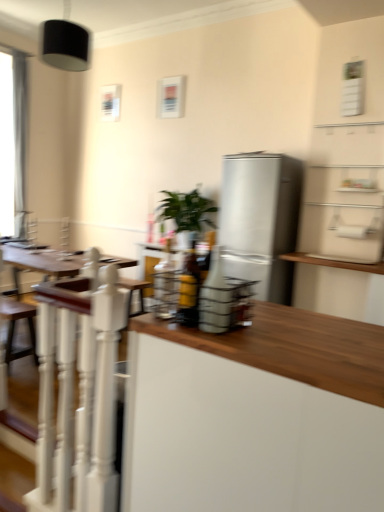
The height and width of the screenshot is (512, 384). Describe the element at coordinates (186, 210) in the screenshot. I see `green leafy plant at center` at that location.

What is the approximate width of black matte lampshade at upper left?

15.95 inches.

Where is `satin silver refrigerator at center`? Image resolution: width=384 pixels, height=512 pixels. satin silver refrigerator at center is located at coordinates (260, 220).

Locate an element on the screen. brown wooden swivel chair at lower left is located at coordinates (14, 328).

Where is `green leafy plant at center`? green leafy plant at center is located at coordinates (186, 210).

Is white painted wood railing at left wider than black matte lampshade at upper left?

No.

From the picture: Is white painted wood railing at left aimed at black matte lampshade at upper left?

No, white painted wood railing at left is not facing towards black matte lampshade at upper left.

Which object is further away from the camera, white painted wood railing at left or black matte lampshade at upper left?

black matte lampshade at upper left.

Would you say white painted wood railing at left is outside black matte lampshade at upper left?

Yes, white painted wood railing at left is located beyond the bounds of black matte lampshade at upper left.

Visually, is satin silver refrigerator at center positioned to the left or to the right of green leafy plant at center?

Clearly, satin silver refrigerator at center is on the right of green leafy plant at center in the image.

Who is bigger, satin silver refrigerator at center or green leafy plant at center?

Bigger between the two is satin silver refrigerator at center.

Is satin silver refrigerator at center in front of or behind green leafy plant at center in the image?

Clearly, satin silver refrigerator at center is in front of green leafy plant at center.

From the image's perspective, is satin silver refrigerator at center under green leafy plant at center?

Indeed, from the image's perspective, satin silver refrigerator at center is shown beneath green leafy plant at center.

Is point (64, 56) positioned behind point (55, 469)?

Yes, it is.

Is black matte lampshade at upper left positioned beyond the bounds of white painted wood railing at left?

Absolutely, black matte lampshade at upper left is external to white painted wood railing at left.

How many degrees apart are the facing directions of black matte lampshade at upper left and white painted wood railing at left?

The facing directions of black matte lampshade at upper left and white painted wood railing at left are 173 degrees apart.

From the image's perspective, would you say black matte lampshade at upper left is shown under white painted wood railing at left?

Incorrect, from the image's perspective, black matte lampshade at upper left is higher than white painted wood railing at left.

Does green leafy plant at center come behind white matte cabinet at center?

Yes, the depth of green leafy plant at center is greater than that of white matte cabinet at center.

Does green leafy plant at center have a greater width compared to white matte cabinet at center?

Incorrect, the width of green leafy plant at center does not surpass that of white matte cabinet at center.

Is green leafy plant at center facing towards white matte cabinet at center?

No, green leafy plant at center is not turned towards white matte cabinet at center.

From the image's perspective, does green leafy plant at center appear higher than white matte cabinet at center?

Yes, from the image's perspective, green leafy plant at center is over white matte cabinet at center.

Considering the sizes of objects brown wooden swivel chair at lower left and satin silver refrigerator at center in the image provided, who is shorter, brown wooden swivel chair at lower left or satin silver refrigerator at center?

With less height is brown wooden swivel chair at lower left.

Between brown wooden swivel chair at lower left and satin silver refrigerator at center, which one has smaller width?

With smaller width is brown wooden swivel chair at lower left.

Is brown wooden swivel chair at lower left facing towards satin silver refrigerator at center?

No, brown wooden swivel chair at lower left does not turn towards satin silver refrigerator at center.

Which of these two, white matte cabinet at center or green leafy plant at center, stands taller?

white matte cabinet at center.

Considering the positions of objects white matte cabinet at center and green leafy plant at center in the image provided, who is more to the right, white matte cabinet at center or green leafy plant at center?

white matte cabinet at center.

Is white matte cabinet at center situated inside green leafy plant at center or outside?

white matte cabinet at center is outside green leafy plant at center.

Between brown wooden swivel chair at lower left and black matte lampshade at upper left, which one has larger width?

Wider between the two is black matte lampshade at upper left.

Which is behind, brown wooden swivel chair at lower left or black matte lampshade at upper left?

Positioned behind is black matte lampshade at upper left.

Which is behind, point (33, 313) or point (70, 24)?

The point (70, 24) is farther from the camera.

Is brown wooden swivel chair at lower left taller or shorter than black matte lampshade at upper left?

In the image, brown wooden swivel chair at lower left appears to be shorter than black matte lampshade at upper left.

Identify the location of light fixture above the white painted wood railing at left (from a real-world perspective). (66, 42).

Find the location of a particular element. refrigerator in front of the green leafy plant at center is located at coordinates (260, 220).

Looking at the image, which one is located closer to black matte lampshade at upper left, white painted wood railing at left or satin silver refrigerator at center?

satin silver refrigerator at center is closer to black matte lampshade at upper left.

From the image, which object appears to be farther from white painted wood railing at left, brown wooden swivel chair at lower left or satin silver refrigerator at center?

satin silver refrigerator at center.

Based on the photo, from the image, which object appears to be nearer to brown wooden swivel chair at lower left, satin silver refrigerator at center or white painted wood railing at left?

white painted wood railing at left is closer to brown wooden swivel chair at lower left.

Looking at the image, which one is located further to black matte lampshade at upper left, green leafy plant at center or white painted wood railing at left?

The object further to black matte lampshade at upper left is white painted wood railing at left.

Based on their spatial positions, is satin silver refrigerator at center or white matte cabinet at center further from brown wooden swivel chair at lower left?

white matte cabinet at center lies further to brown wooden swivel chair at lower left than the other object.

Estimate the real-world distances between objects in this image. Which object is closer to green leafy plant at center, satin silver refrigerator at center or black matte lampshade at upper left?

The object closer to green leafy plant at center is satin silver refrigerator at center.

Based on their spatial positions, is brown wooden swivel chair at lower left or white matte cabinet at center closer to black matte lampshade at upper left?

brown wooden swivel chair at lower left lies closer to black matte lampshade at upper left than the other object.

Based on their spatial positions, is white painted wood railing at left or black matte lampshade at upper left closer to white matte cabinet at center?

The object closer to white matte cabinet at center is white painted wood railing at left.

The width and height of the screenshot is (384, 512). Identify the location of refrigerator that lies between black matte lampshade at upper left and brown wooden swivel chair at lower left from top to bottom. click(260, 220).

You are a GUI agent. You are given a task and a screenshot of the screen. Output one action in this format:
    pyautogui.click(x=<x>, y=<y>)
    Task: Click on the swivel chair located between white matte cabinet at center and green leafy plant at center in the depth direction
    
    Given the screenshot: What is the action you would take?
    click(x=14, y=328)

Where is `rail between black matte lampshade at upper left and white matte cabinet at center in the up-down direction`? rail between black matte lampshade at upper left and white matte cabinet at center in the up-down direction is located at coordinates (80, 397).

You are a GUI agent. You are given a task and a screenshot of the screen. Output one action in this format:
    pyautogui.click(x=<x>, y=<y>)
    Task: Click on the swivel chair between black matte lampshade at upper left and white painted wood railing at left from top to bottom
    
    Given the screenshot: What is the action you would take?
    pyautogui.click(x=14, y=328)